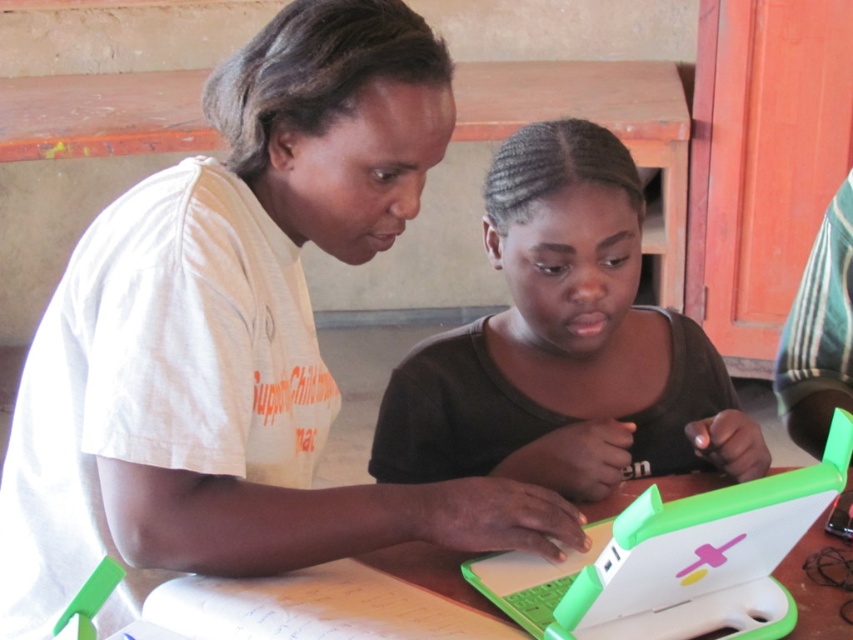
Consider the image. You are standing in the room where the two people are interacting with the laptop. From your perspective, which point is closer to you, point (390,218) or point (779,490)?

Point (779,490) is closer to you because the description states that point (390,218) is behind point (779,490).

You are standing in the room and want to hand a document to the person wearing the white matte shirt at upper left. Which direction should you move to approach them?

The white matte shirt at upper left is located at point (236, 339), so you should move towards the upper left direction to approach them.

You are an observer in the scene. You need to determine which object takes up more space in your field of view. Which is larger in size between the white matte shirt at upper left and the matte green laptop at center?

→ The white matte shirt at upper left is larger in size than the matte green laptop at center according to the description.